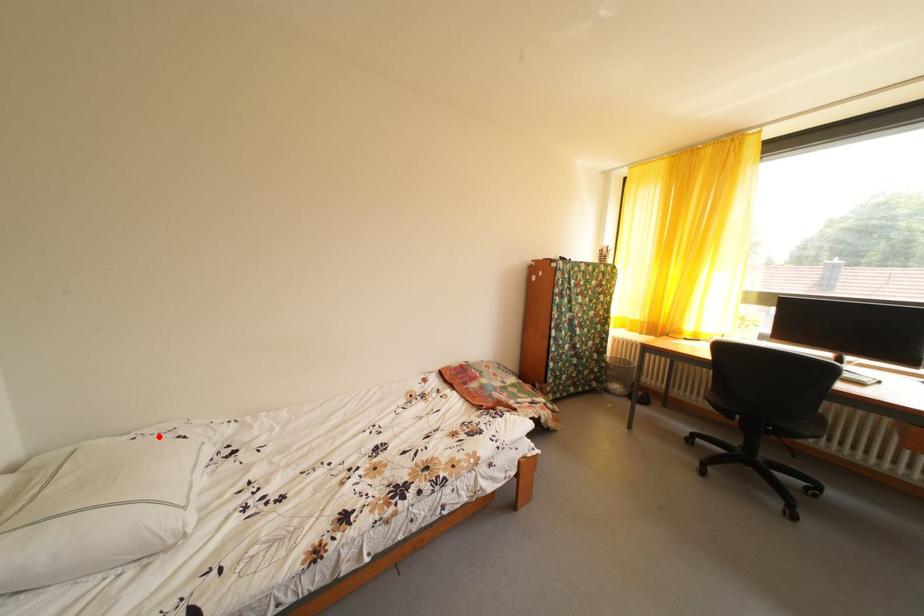
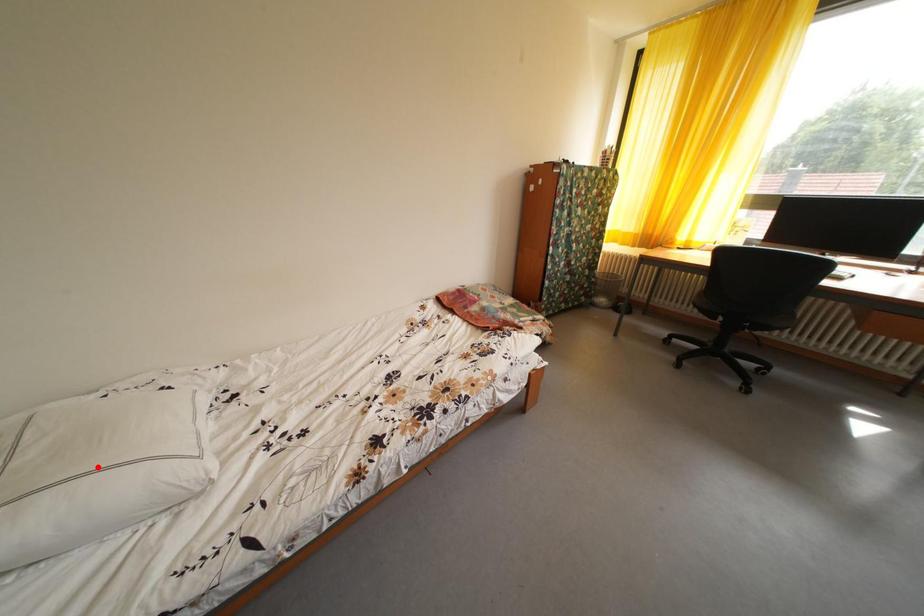
I am providing you with two images of the same scene from different viewpoints. A red point is marked on the first image and another point is marked on the second image. Are the points marked in image1 and image2 representing the same 3D position?

No